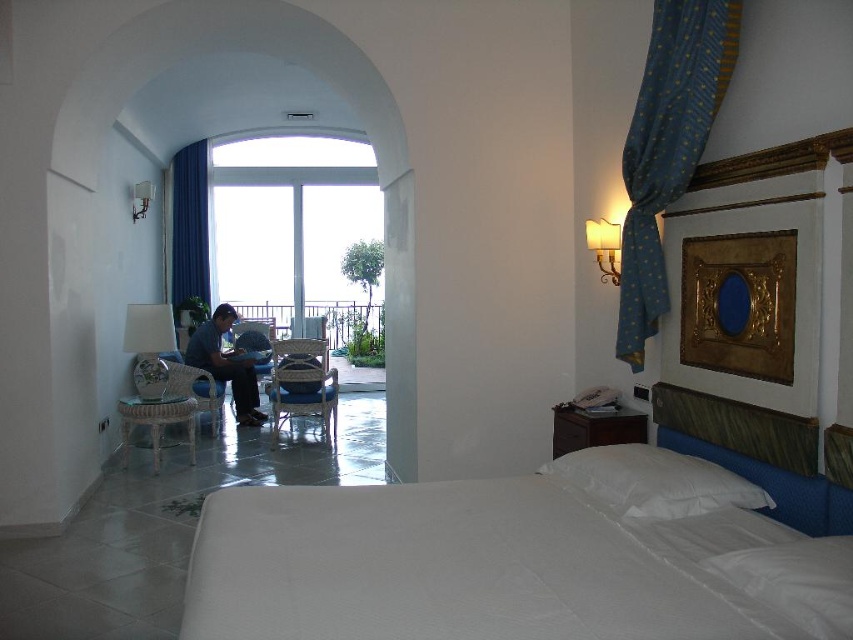
Question: Can you confirm if blue fabric chair at center is positioned to the left of wicker chair at left?

Choices:
 (A) no
 (B) yes

Answer: (A)

Question: Is blue fabric chair at center further to camera compared to wicker chair at left?

Choices:
 (A) yes
 (B) no

Answer: (A)

Question: Which object is the farthest from the blue fabric chair at center?

Choices:
 (A) transparent glass window at center
 (B) white soft pillow at center
 (C) blue fabric curtain at left
 (D) blue fabric armchair at center

Answer: (B)

Question: Which of the following is the closest to the observer?

Choices:
 (A) (318, 396)
 (B) (262, 324)

Answer: (A)

Question: Which object is closer to the camera taking this photo?

Choices:
 (A) wicker armchair at center
 (B) white soft pillow at center
 (C) blue textured fabric at upper right
 (D) blue fabric armchair at center

Answer: (B)

Question: Can you confirm if blue fabric chair at center is smaller than blue fabric armchair at center?

Choices:
 (A) yes
 (B) no

Answer: (A)